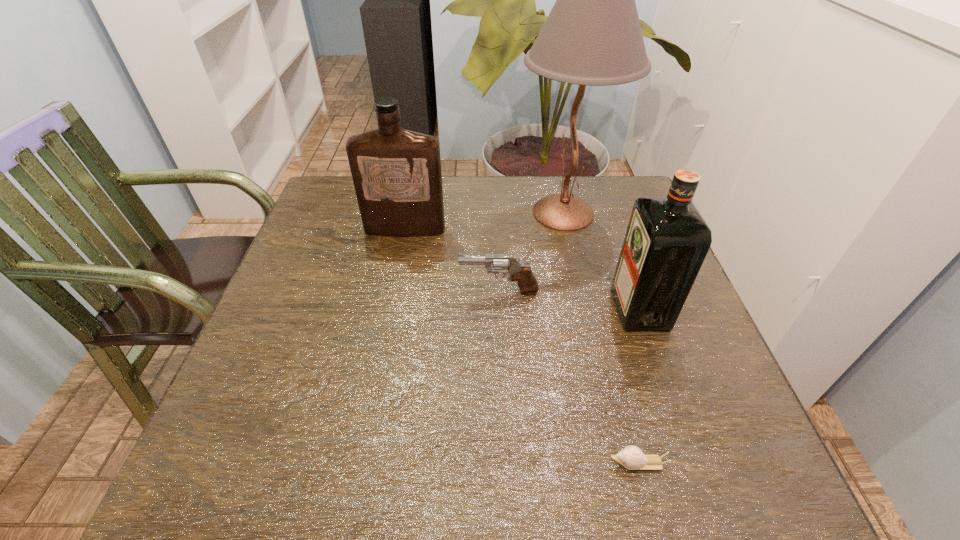
This screenshot has height=540, width=960. Find the location of `table lamp situated at the far edge`. table lamp situated at the far edge is located at coordinates (592, 36).

Where is `liquor located in the far edge section of the desktop`? liquor located in the far edge section of the desktop is located at coordinates click(x=396, y=173).

The width and height of the screenshot is (960, 540). In order to click on object situated at the near edge in this screenshot , I will do `click(631, 457)`.

Where is `object that is at the left edge`? This screenshot has height=540, width=960. object that is at the left edge is located at coordinates (396, 173).

The image size is (960, 540). Find the location of `table lamp present at the right edge`. table lamp present at the right edge is located at coordinates (592, 36).

Where is `liquor that is at the right edge`? This screenshot has height=540, width=960. liquor that is at the right edge is located at coordinates (667, 239).

Image resolution: width=960 pixels, height=540 pixels. I want to click on escargot situated at the right edge, so click(631, 457).

You are a GUI agent. You are given a task and a screenshot of the screen. Output one action in this format:
    pyautogui.click(x=<x>, y=<y>)
    Task: Click on the object that is at the far left corner
    The width and height of the screenshot is (960, 540).
    Given the screenshot: What is the action you would take?
    396,173

At what (x,y) coordinates should I click in order to perform the action: click on object present at the far right corner. Please return your answer as a coordinate pair (x, y). Looking at the image, I should click on (592, 36).

Find the location of `object that is at the near right corner`. object that is at the near right corner is located at coordinates (631, 457).